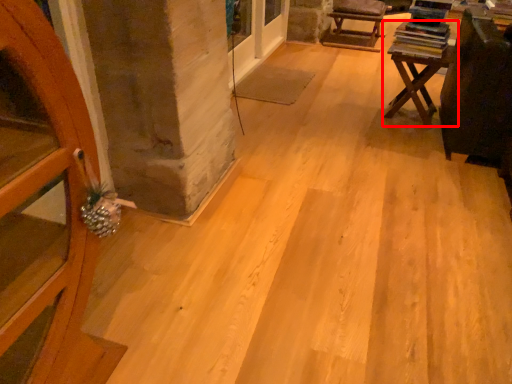
Question: From the image's perspective, considering the relative positions of table (annotated by the red box) and armchair in the image provided, where is table (annotated by the red box) located with respect to the staircase?

Choices:
 (A) below
 (B) above

Answer: (A)